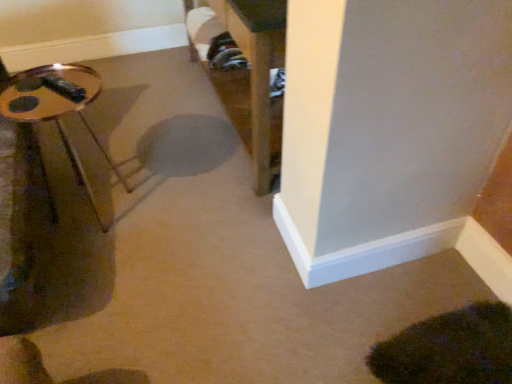
The height and width of the screenshot is (384, 512). Find the location of `metallic glass table at left`. metallic glass table at left is located at coordinates (58, 110).

What do you see at coordinates (58, 110) in the screenshot? I see `metallic glass table at left` at bounding box center [58, 110].

What is the approximate width of metallic glass table at left?

metallic glass table at left is 16.30 inches wide.

Locate an element on the screen. The width and height of the screenshot is (512, 384). metallic glass table at left is located at coordinates (58, 110).